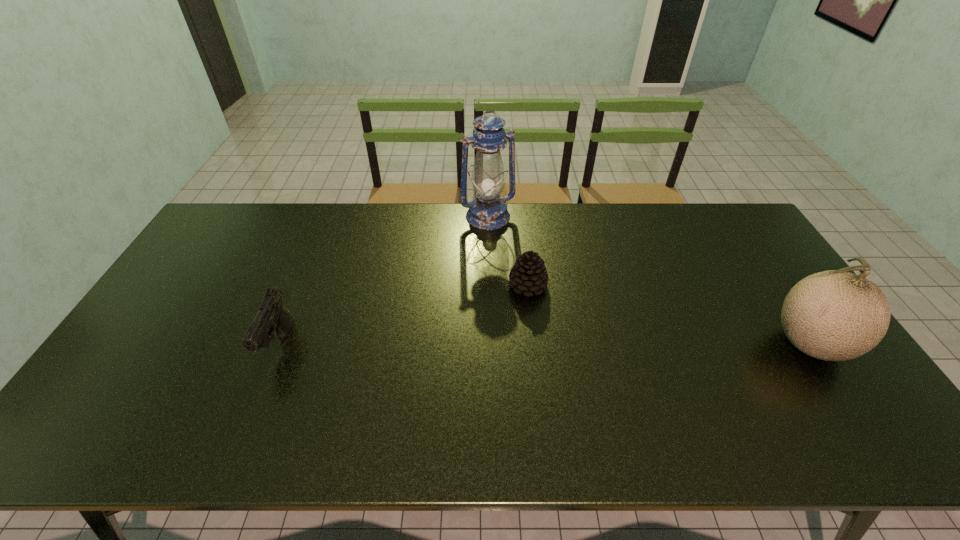
Locate an element on the screen. This screenshot has height=540, width=960. vacant spot on the desktop that is between the leftmost object and the rightmost object and is positioned on the front-facing side of the lantern is located at coordinates (558, 344).

The width and height of the screenshot is (960, 540). I want to click on vacant space on the desktop that is between the pistol and the rightmost object and is positioned at the narrow end of the pinecone, so click(x=585, y=344).